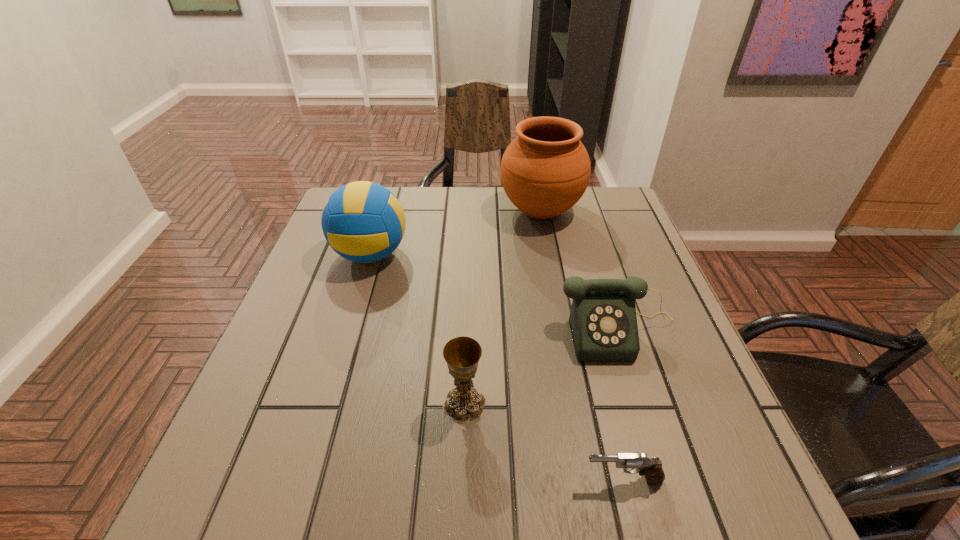
You are a GUI agent. You are given a task and a screenshot of the screen. Output one action in this format:
    pyautogui.click(x=<x>, y=<y>)
    Task: Click on the tallest object
    This screenshot has width=960, height=540.
    Given the screenshot: What is the action you would take?
    pyautogui.click(x=545, y=170)

Identify the location of volleyball. This screenshot has width=960, height=540. (362, 221).

Locate an element on the screen. the second tallest object is located at coordinates (362, 221).

Find the location of a particular element. This screenshot has height=540, width=960. chalice is located at coordinates (462, 354).

This screenshot has height=540, width=960. In order to click on the third shortest object in this screenshot , I will do `click(462, 354)`.

Locate an element on the screen. the second shortest object is located at coordinates (603, 322).

At what (x,y) coordinates should I click in order to perform the action: click on the third nearest object. Please return your answer as a coordinate pair (x, y). The width and height of the screenshot is (960, 540). Looking at the image, I should click on (603, 322).

In order to click on the shortest object in this screenshot , I will do `click(651, 467)`.

What are the coordinates of `pistol` in the screenshot? It's located at (651, 467).

Image resolution: width=960 pixels, height=540 pixels. In order to click on vacant space located 0.230m on the left of the pottery in this screenshot , I will do `click(420, 212)`.